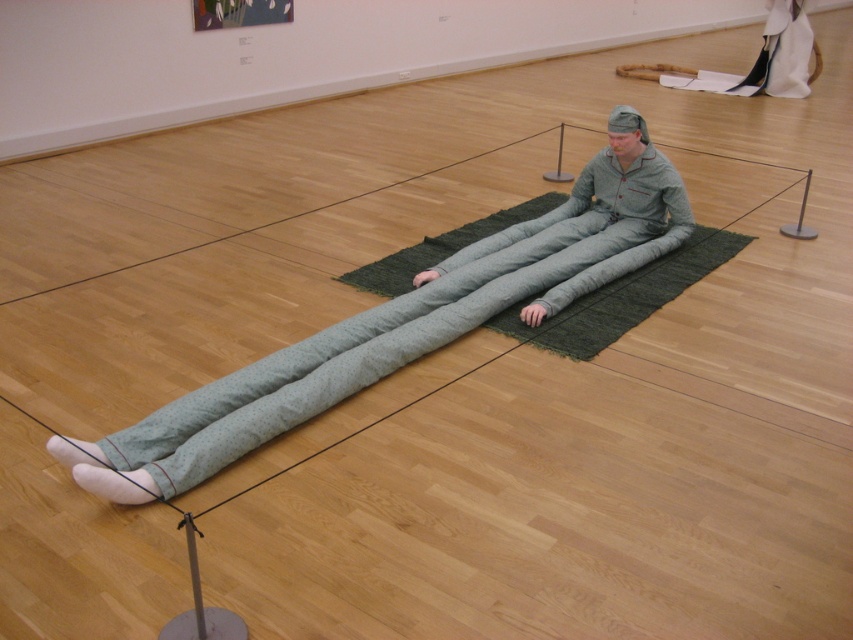
Question: Which of the following is the farthest from the observer?

Choices:
 (A) green fabric figure at center
 (B) green woven mat at center

Answer: (B)

Question: Among these objects, which one is nearest to the camera?

Choices:
 (A) green fabric figure at center
 (B) green woven mat at center

Answer: (A)

Question: Is green fabric figure at center bigger than green woven mat at center?

Choices:
 (A) yes
 (B) no

Answer: (A)

Question: Does green fabric figure at center appear over green woven mat at center?

Choices:
 (A) yes
 (B) no

Answer: (B)

Question: Can you confirm if green fabric figure at center is positioned below green woven mat at center?

Choices:
 (A) no
 (B) yes

Answer: (B)

Question: Which point is farther to the camera?

Choices:
 (A) green fabric figure at center
 (B) green woven mat at center

Answer: (B)